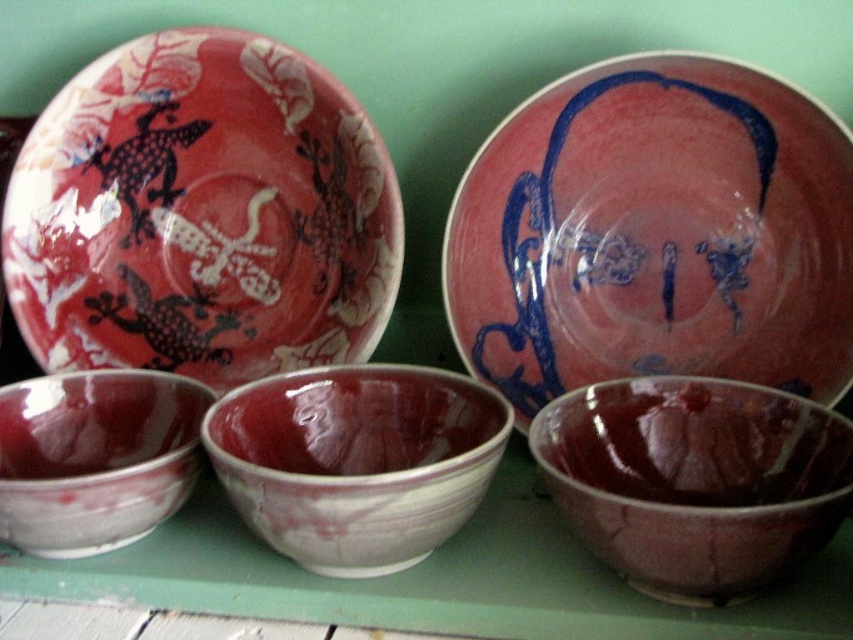
Question: Which object is positioned closest to the matte ceramic bowl at center?

Choices:
 (A) matte red plate at upper left
 (B) matte pink plate at center
 (C) matte porcelain bowl at lower left
 (D) maroon glossy bowls at center

Answer: (D)

Question: Is matte burgundy bowl at lower right to the left of matte ceramic bowl at center from the viewer's perspective?

Choices:
 (A) yes
 (B) no

Answer: (B)

Question: Can you confirm if matte red plate at upper left is positioned to the left of maroon glossy bowls at center?

Choices:
 (A) no
 (B) yes

Answer: (B)

Question: Is matte pink plate at center smaller than matte burgundy bowl at lower right?

Choices:
 (A) no
 (B) yes

Answer: (A)

Question: Which is farther from the matte burgundy bowl at lower right?

Choices:
 (A) matte porcelain bowl at lower left
 (B) matte red plate at upper left

Answer: (B)

Question: Estimate the real-world distances between objects in this image. Which object is closer to the matte red plate at upper left?

Choices:
 (A) matte burgundy bowl at lower right
 (B) maroon glossy bowls at center

Answer: (B)